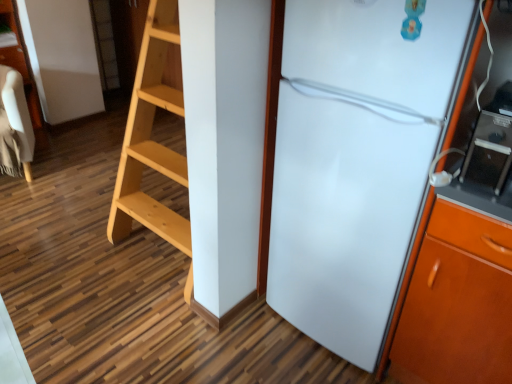
Question: Considering the relative positions of beige fabric chair at left and white glossy refrigerator at right in the image provided, is beige fabric chair at left to the left of white glossy refrigerator at right from the viewer's perspective?

Choices:
 (A) yes
 (B) no

Answer: (A)

Question: Is beige fabric chair at left positioned beyond the bounds of white glossy refrigerator at right?

Choices:
 (A) yes
 (B) no

Answer: (A)

Question: Is beige fabric chair at left surrounding white glossy refrigerator at right?

Choices:
 (A) no
 (B) yes

Answer: (A)

Question: From a real-world perspective, is beige fabric chair at left located beneath white glossy refrigerator at right?

Choices:
 (A) yes
 (B) no

Answer: (A)

Question: Is beige fabric chair at left turned away from white glossy refrigerator at right?

Choices:
 (A) no
 (B) yes

Answer: (A)

Question: Is beige fabric chair at left aimed at white glossy refrigerator at right?

Choices:
 (A) no
 (B) yes

Answer: (A)

Question: Is beige fabric chair at left thinner than black glossy microwave at right?

Choices:
 (A) no
 (B) yes

Answer: (A)

Question: Can you confirm if beige fabric chair at left is smaller than black glossy microwave at right?

Choices:
 (A) yes
 (B) no

Answer: (B)

Question: Can you confirm if beige fabric chair at left is bigger than black glossy microwave at right?

Choices:
 (A) yes
 (B) no

Answer: (A)

Question: Is beige fabric chair at left taller than black glossy microwave at right?

Choices:
 (A) no
 (B) yes

Answer: (B)

Question: Does beige fabric chair at left lie in front of black glossy microwave at right?

Choices:
 (A) yes
 (B) no

Answer: (B)

Question: From a real-world perspective, is beige fabric chair at left positioned over black glossy microwave at right based on gravity?

Choices:
 (A) no
 (B) yes

Answer: (A)

Question: Does white glossy refrigerator at right have a smaller size compared to black glossy microwave at right?

Choices:
 (A) no
 (B) yes

Answer: (A)